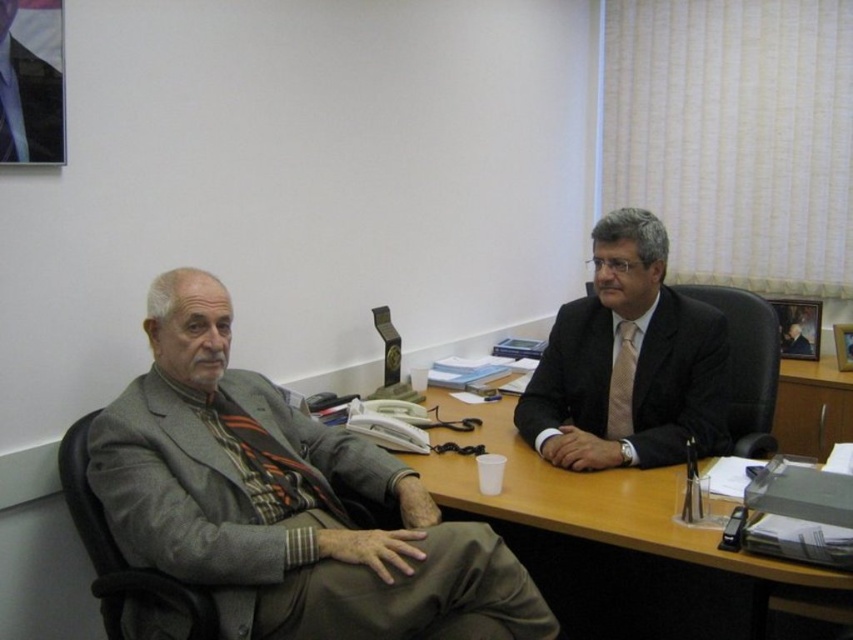
Question: From the image, what is the correct spatial relationship of matte black suit at right in relation to beige silk tie at center?

Choices:
 (A) left
 (B) right

Answer: (B)

Question: Can you confirm if gray wool suit at left is positioned above wooden desk at center?

Choices:
 (A) yes
 (B) no

Answer: (A)

Question: Which point appears farthest from the camera in this image?

Choices:
 (A) (596, 616)
 (B) (230, 508)
 (C) (659, 308)

Answer: (A)

Question: Based on their relative distances, which object is farther from the wooden desk at center?

Choices:
 (A) matte black suit at right
 (B) beige silk tie at center

Answer: (B)

Question: Considering the real-world distances, which object is farthest from the matte black suit at right?

Choices:
 (A) gray wool suit at left
 (B) beige silk tie at center
 (C) wooden desk at center

Answer: (A)

Question: Where is matte black suit at right located in relation to beige silk tie at center in the image?

Choices:
 (A) left
 (B) right

Answer: (B)